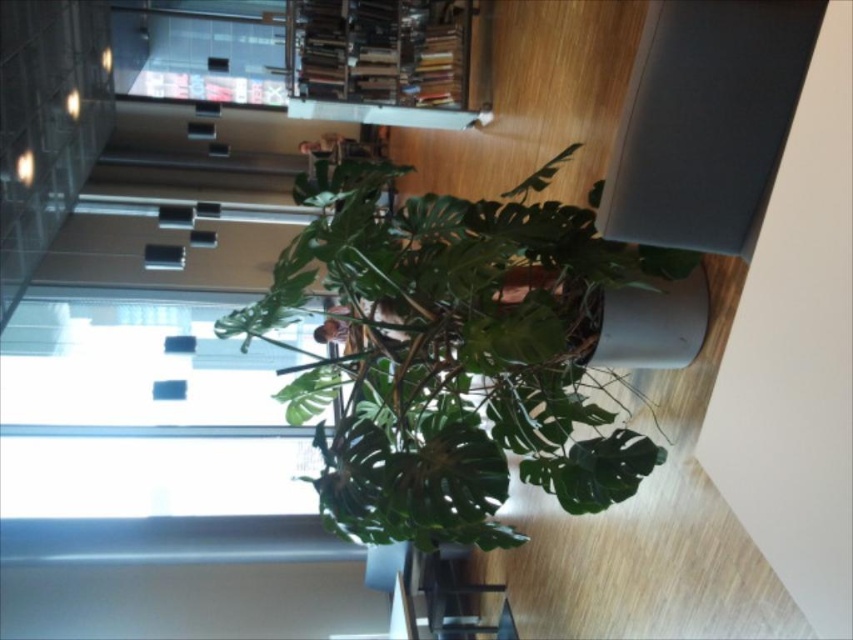
You are standing in this library and want to place a book on the transparent glass table at lower center. To reach it, you need to walk around the green leafy plant at center. Which direction should you move relative to the plant?

Since the green leafy plant at center is closer to the viewer than the transparent glass table at lower center, you should move backward away from the plant to reach the transparent glass table at lower center.

You are organizing a small event in this space and need to place a 1.5 meter long tablecloth on the transparent glass table at lower center. Considering the green leafy plant at center is nearby, will the tablecloth fit without overlapping the plant?

The green leafy plant at center is wider than the transparent glass table at lower center. Since the tablecloth is 1.5 meters long, it may extend beyond the table, but the plant being wider than the table suggests that placing the tablecloth might not overlap the plant as the plant occupies more space around the table.